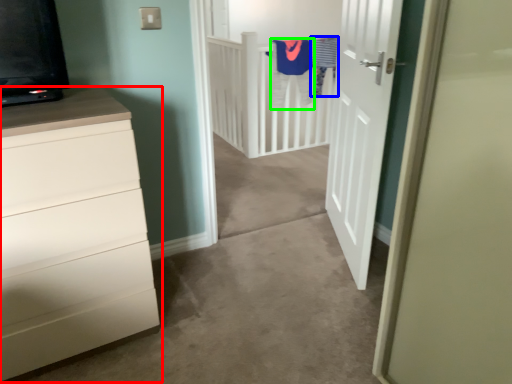
Question: Which object is positioned farthest from chest of drawers (highlighted by a red box)? Select from laundry (highlighted by a blue box) and robe (highlighted by a green box).

Choices:
 (A) laundry
 (B) robe

Answer: (A)